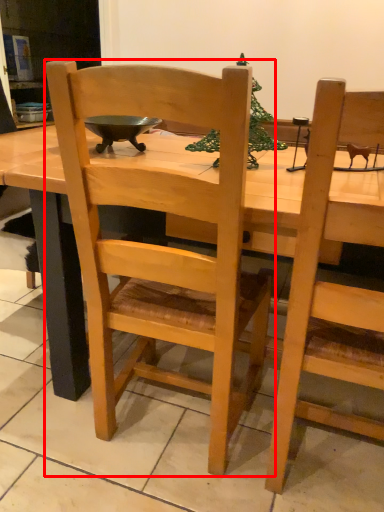
Question: From the image's perspective, where is chair (annotated by the red box) located relative to desk?

Choices:
 (A) above
 (B) below

Answer: (B)